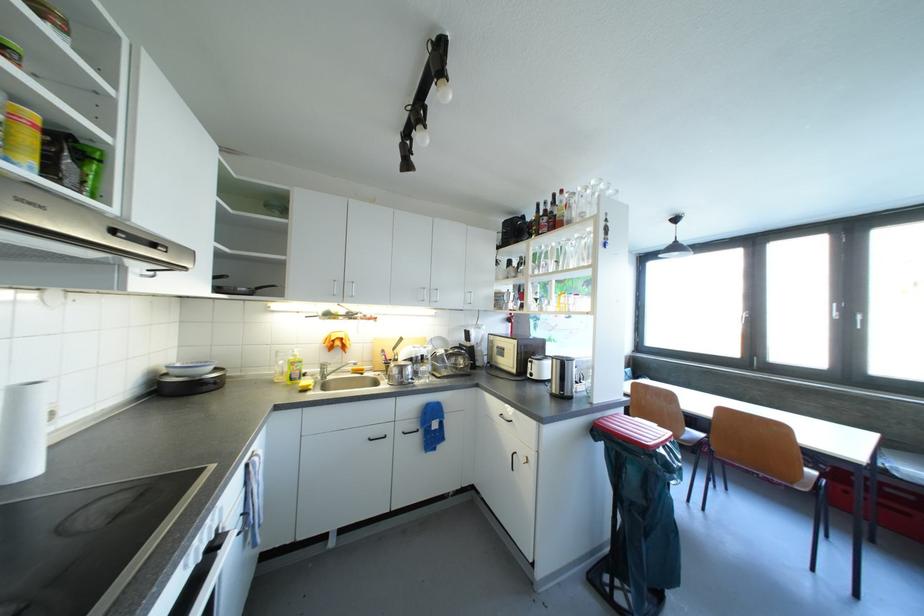
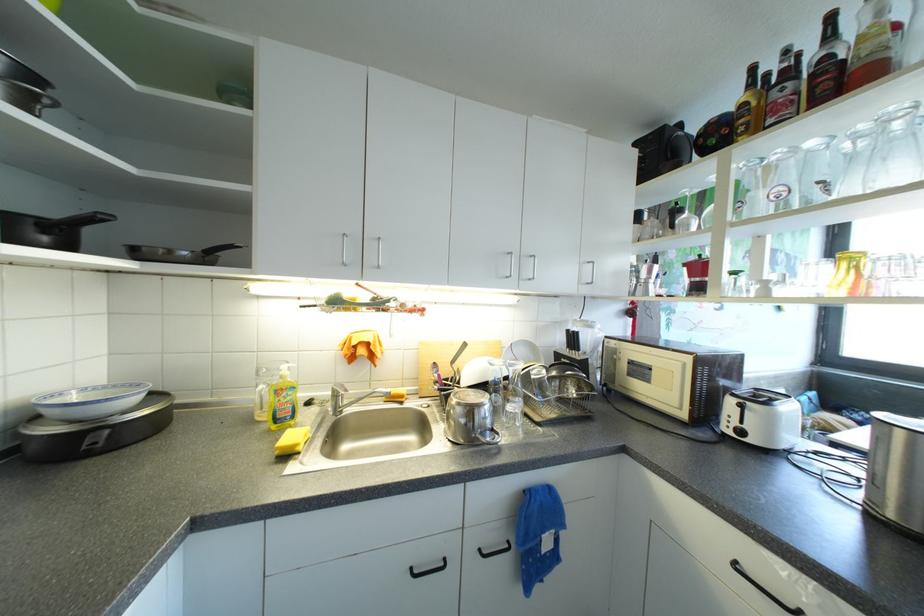
Question: The camera is either moving clockwise (left) or counter-clockwise (right) around the object. The first image is from the beginning of the video and the second image is from the end. Is the camera moving left or right when shooting the video?

Choices:
 (A) Left
 (B) Right

Answer: (B)